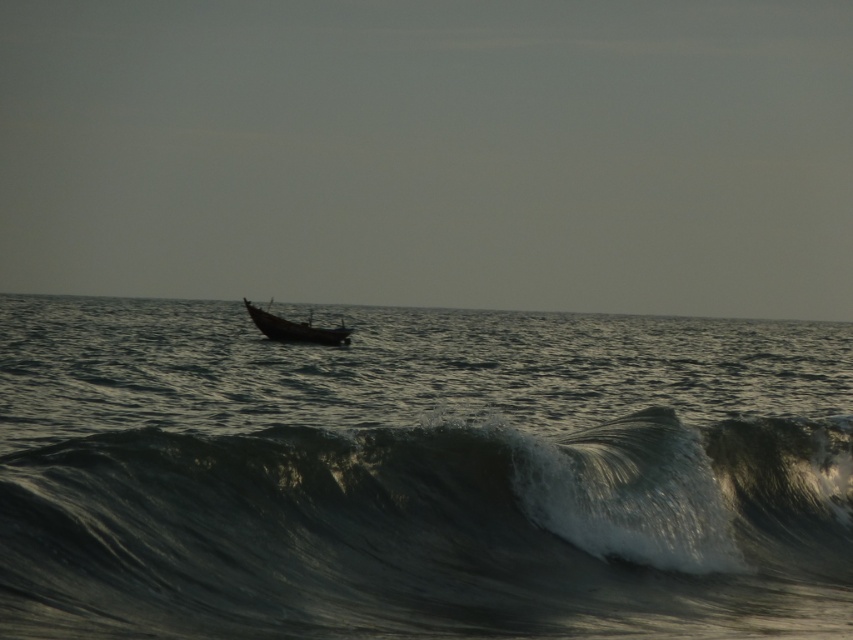
Who is positioned more to the right, shiny dark gray wave at center or dark matte boat at center?

From the viewer's perspective, shiny dark gray wave at center appears more on the right side.

Where is `shiny dark gray wave at center`? shiny dark gray wave at center is located at coordinates (432, 531).